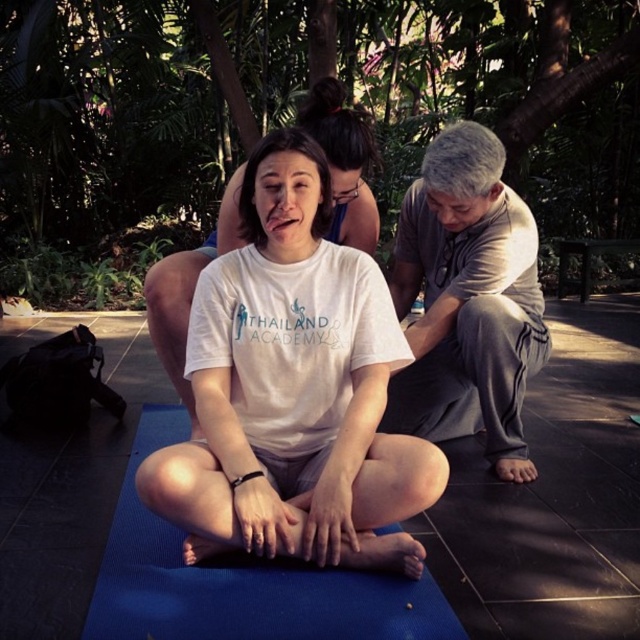
Between point (195, 406) and point (465, 182), which one is positioned behind?

The point (465, 182) is more distant.

Who is positioned more to the left, white cotton t-shirt at center or gray cotton shirt at upper right?

white cotton t-shirt at center

Is point (300, 552) farther from camera compared to point (509, 259)?

No, (300, 552) is closer to viewer.

Image resolution: width=640 pixels, height=640 pixels. Find the location of `white cotton t-shirt at center`. white cotton t-shirt at center is located at coordinates (292, 392).

Does gray cotton shirt at upper right have a larger size compared to blue rubber yoga mat at center?

Incorrect, gray cotton shirt at upper right is not larger than blue rubber yoga mat at center.

Can you confirm if gray cotton shirt at upper right is shorter than blue rubber yoga mat at center?

No.

Is point (444, 392) positioned behind point (392, 593)?

Yes, point (444, 392) is farther from viewer.

Locate an element on the screen. Image resolution: width=640 pixels, height=640 pixels. gray cotton shirt at upper right is located at coordinates (467, 300).

What do you see at coordinates (292, 392) in the screenshot? Image resolution: width=640 pixels, height=640 pixels. I see `white cotton t-shirt at center` at bounding box center [292, 392].

Between white cotton t-shirt at center and blue rubber yoga mat at center, which one is positioned higher?

white cotton t-shirt at center

Where is `white cotton t-shirt at center`? white cotton t-shirt at center is located at coordinates (292, 392).

Locate an element on the screen. The width and height of the screenshot is (640, 640). white cotton t-shirt at center is located at coordinates (292, 392).